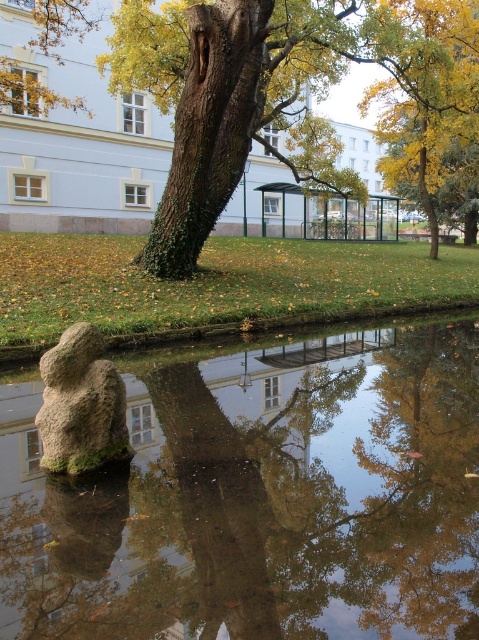
Question: Which object appears farthest from the camera in this image?

Choices:
 (A) yellow-green leaves at upper center
 (B) transparent glass water at center
 (C) green rough bark tree at center

Answer: (A)

Question: Which of the following is the closest to the observer?

Choices:
 (A) (449, 58)
 (B) (90, 385)
 (C) (258, 545)

Answer: (C)

Question: Does transparent glass water at center have a greater width compared to gray rough stone at lower left?

Choices:
 (A) no
 (B) yes

Answer: (B)

Question: Among these objects, which one is nearest to the camera?

Choices:
 (A) transparent glass water at center
 (B) yellow-green leaves at upper center
 (C) green rough bark tree at center
 (D) gray rough stone at lower left

Answer: (A)

Question: Does green rough bark tree at center appear over yellow-green leaves at upper center?

Choices:
 (A) no
 (B) yes

Answer: (A)

Question: In this image, where is green rough bark tree at center located relative to yellow-green leaves at upper center?

Choices:
 (A) above
 (B) below

Answer: (B)